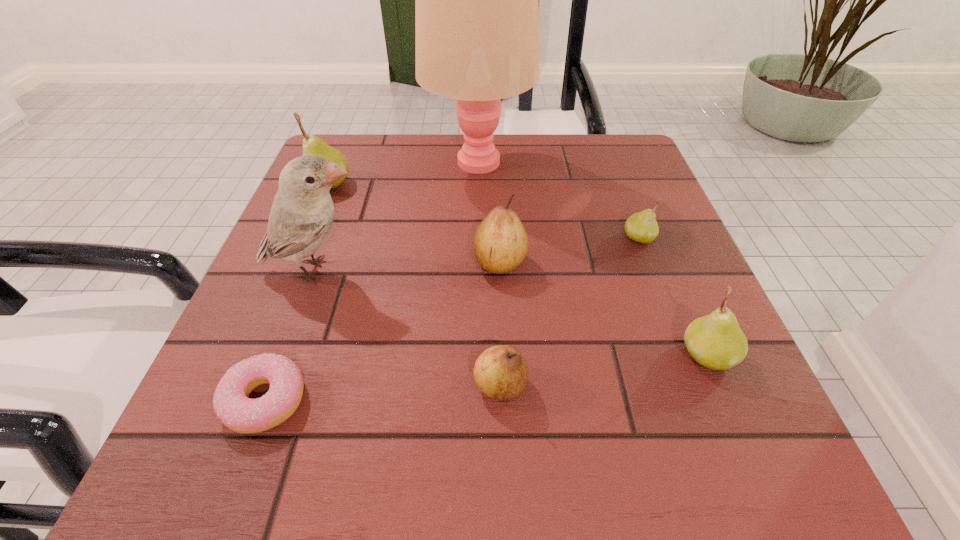
Find the location of a particular element. The width and height of the screenshot is (960, 540). lampshade positioned at the far edge is located at coordinates (476, 0).

The height and width of the screenshot is (540, 960). What are the coordinates of `pear present at the far edge` in the screenshot? It's located at (312, 145).

The width and height of the screenshot is (960, 540). What are the coordinates of `object at the near edge` in the screenshot? It's located at (231, 403).

This screenshot has height=540, width=960. I want to click on bird that is at the left edge, so click(x=302, y=213).

You are a GUI agent. You are given a task and a screenshot of the screen. Output one action in this format:
    pyautogui.click(x=<x>, y=<y>)
    Task: Click on the pear at the left edge
    The height and width of the screenshot is (540, 960).
    Given the screenshot: What is the action you would take?
    pyautogui.click(x=312, y=145)

Image resolution: width=960 pixels, height=540 pixels. I want to click on doughnut located at the left edge, so click(x=231, y=403).

Where is `object located in the far left corner section of the desktop`? The height and width of the screenshot is (540, 960). object located in the far left corner section of the desktop is located at coordinates (312, 145).

Identify the location of object that is at the near left corner. Image resolution: width=960 pixels, height=540 pixels. (231, 403).

At what (x,y) coordinates should I click in order to perform the action: click on vacant region at the far edge of the desktop. Please return your answer as a coordinate pair (x, y). Looking at the image, I should click on (411, 147).

Where is `vacant space at the near edge of the desktop`? The width and height of the screenshot is (960, 540). vacant space at the near edge of the desktop is located at coordinates (376, 445).